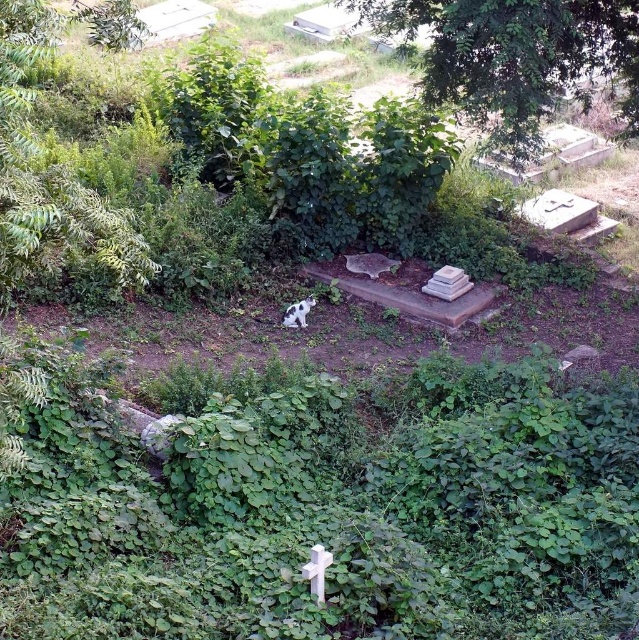
Is green leafy plants at center in front of spotted fur cat at center?

Yes, it is.

Can you confirm if green leafy plants at center is wider than spotted fur cat at center?

Indeed, green leafy plants at center has a greater width compared to spotted fur cat at center.

Is point (47, 497) positioned before point (288, 307)?

Yes, point (47, 497) is closer to viewer.

Identify the location of green leafy plants at center. This screenshot has height=640, width=639. (330, 509).

What do you see at coordinates (514, 58) in the screenshot? I see `green leafy tree at upper center` at bounding box center [514, 58].

You are a GUI agent. You are given a task and a screenshot of the screen. Output one action in this format:
    pyautogui.click(x=<x>, y=<y>)
    Task: Click on the green leafy tree at upper center
    Image resolution: width=639 pixels, height=640 pixels.
    Given the screenshot: What is the action you would take?
    pyautogui.click(x=514, y=58)

Does point (394, 536) come in front of point (511, 36)?

Yes, it is.

Is green leafy plants at center wider than green leafy tree at upper center?

Yes, green leafy plants at center is wider than green leafy tree at upper center.

At what (x,y) coordinates should I click in order to perform the action: click on green leafy plants at center. Please return your answer as a coordinate pair (x, y). Image resolution: width=639 pixels, height=640 pixels. Looking at the image, I should click on (330, 509).